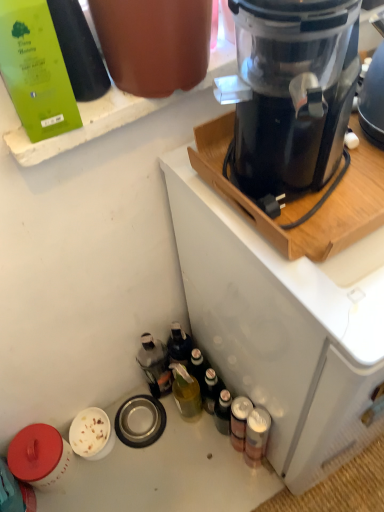
What do you see at coordinates (292, 87) in the screenshot?
I see `black plastic blender at upper right` at bounding box center [292, 87].

Identify the location of black plastic coffee maker at upper right. (283, 327).

What do you see at coordinates (79, 50) in the screenshot? Image resolution: width=384 pixels, height=512 pixels. I see `green matte bottle at upper left, which ranks as the 3th bottle in back-to-front order` at bounding box center [79, 50].

Locate an element on the screen. black plastic blender at upper right is located at coordinates (292, 87).

This screenshot has height=512, width=384. Identify the location of the 3rd bottle counting from the left side of the black plastic coffee maker at upper right. (79, 50).

Would you say green matte bottle at upper left, the first bottle from the front, is outside black plastic coffee maker at upper right?

Yes, green matte bottle at upper left, the first bottle from the front, is located beyond the bounds of black plastic coffee maker at upper right.

From a real-world perspective, who is located higher, green matte bottle at upper left, positioned as the 1th bottle in top-to-bottom order, or black plastic coffee maker at upper right?

In real-world perspective, green matte bottle at upper left, positioned as the 1th bottle in top-to-bottom order, is above.

Based on the photo, is green matte bottle at upper left, positioned as the 1th bottle in top-to-bottom order, facing away from black plastic coffee maker at upper right?

That's not correct — green matte bottle at upper left, positioned as the 1th bottle in top-to-bottom order, is not looking away from black plastic coffee maker at upper right.

Measure the distance from translucent plastic bottle at lower left, the 2th bottle from the top, to metallic silver can at lower right, the 2th bottle positioned from the front.

The distance of translucent plastic bottle at lower left, the 2th bottle from the top, from metallic silver can at lower right, the 2th bottle positioned from the front, is 11.79 inches.

Is translucent plastic bottle at lower left, placed as the 2th bottle when sorted from bottom to top, thinner than metallic silver can at lower right, the 2th bottle positioned from the front?

No.

Between translucent plastic bottle at lower left, the 3th bottle positioned from the front, and metallic silver can at lower right, the 3th bottle when ordered from top to bottom, which one appears on the left side from the viewer's perspective?

translucent plastic bottle at lower left, the 3th bottle positioned from the front, is more to the left.

Is black plastic coffee maker at upper right situated inside black plastic blender at upper right or outside?

black plastic coffee maker at upper right cannot be found inside black plastic blender at upper right.

From a real-world perspective, is black plastic coffee maker at upper right on top of black plastic blender at upper right?

Actually, black plastic coffee maker at upper right is physically below black plastic blender at upper right in the real world.

Is black plastic coffee maker at upper right to the left of black plastic blender at upper right from the viewer's perspective?

No.

Is black plastic coffee maker at upper right facing away from black plastic blender at upper right?

No, black plastic coffee maker at upper right's orientation is not away from black plastic blender at upper right.

Looking at this image, from the image's perspective, is metallic silver can at lower right, the 1th bottle in the bottom-to-top sequence, under translucent plastic bottle at lower left, the 2th bottle from the top?

Yes, from the image's perspective, metallic silver can at lower right, the 1th bottle in the bottom-to-top sequence, is below translucent plastic bottle at lower left, the 2th bottle from the top.

Is metallic silver can at lower right, positioned as the 1th bottle in right-to-left order, looking in the opposite direction of translucent plastic bottle at lower left, placed as the 2th bottle when sorted from bottom to top?

No, metallic silver can at lower right, positioned as the 1th bottle in right-to-left order, is not facing away from translucent plastic bottle at lower left, placed as the 2th bottle when sorted from bottom to top.

Where is `bottle that is on the right side of translucent plastic bottle at lower left, the 2th bottle from the top`? This screenshot has height=512, width=384. bottle that is on the right side of translucent plastic bottle at lower left, the 2th bottle from the top is located at coordinates (239, 421).

Based on their positions, is metallic silver can at lower right, the 1th bottle in the bottom-to-top sequence, located to the left or right of translucent plastic bottle at lower left, the first bottle from the back?

In the image, metallic silver can at lower right, the 1th bottle in the bottom-to-top sequence, appears on the right side of translucent plastic bottle at lower left, the first bottle from the back.

From a real-world perspective, is translucent plastic bottle at lower left, placed as the 2th bottle when sorted from bottom to top, positioned above or below green matte bottle at upper left, the third bottle from the right?

In terms of real-world spatial position, translucent plastic bottle at lower left, placed as the 2th bottle when sorted from bottom to top, is below green matte bottle at upper left, the third bottle from the right.

Looking at this image, considering the relative positions of translucent plastic bottle at lower left, the second bottle viewed from the left, and green matte bottle at upper left, which ranks as the 3th bottle in back-to-front order, in the image provided, is translucent plastic bottle at lower left, the second bottle viewed from the left, to the left or to the right of green matte bottle at upper left, which ranks as the 3th bottle in back-to-front order,?

translucent plastic bottle at lower left, the second bottle viewed from the left, is positioned on green matte bottle at upper left, which ranks as the 3th bottle in back-to-front order,'s right side.

Is green matte bottle at upper left, the first bottle from the front, at the back of translucent plastic bottle at lower left, the first bottle from the back?

translucent plastic bottle at lower left, the first bottle from the back, is not turned away from green matte bottle at upper left, the first bottle from the front.

Which of these two, black plastic blender at upper right or black plastic coffee maker at upper right, is thinner?

black plastic blender at upper right is thinner.

Which object is positioned more to the left, black plastic blender at upper right or black plastic coffee maker at upper right?

From the viewer's perspective, black plastic blender at upper right appears more on the left side.

Does point (315, 162) appear closer or farther from the camera than point (245, 281)?

Point (315, 162).

In terms of height, does metallic silver can at lower right, the 2th bottle in the back-to-front sequence, look taller or shorter compared to black plastic blender at upper right?

metallic silver can at lower right, the 2th bottle in the back-to-front sequence, is shorter than black plastic blender at upper right.

Could you tell me if metallic silver can at lower right, arranged as the third bottle when viewed from the left, is facing black plastic blender at upper right?

No.

From the image's perspective, does metallic silver can at lower right, the 2th bottle positioned from the front, appear lower than black plastic blender at upper right?

Correct, metallic silver can at lower right, the 2th bottle positioned from the front, appears lower than black plastic blender at upper right in the image.

Is metallic silver can at lower right, the 2th bottle positioned from the front, placed right next to black plastic blender at upper right?

No.

Where is `home appliance below the green matte bottle at upper left, the 3th bottle ordered from the bottom (from the image's perspective)`? home appliance below the green matte bottle at upper left, the 3th bottle ordered from the bottom (from the image's perspective) is located at coordinates (283, 327).

Where is `bottle located underneath the translucent plastic bottle at lower left, arranged as the 2th bottle when viewed from the right (from a real-world perspective)`? bottle located underneath the translucent plastic bottle at lower left, arranged as the 2th bottle when viewed from the right (from a real-world perspective) is located at coordinates (239, 421).

When comparing their distances from metallic silver can at lower right, positioned as the 1th bottle in right-to-left order, does black plastic blender at upper right or green matte bottle at upper left, the 3th bottle ordered from the bottom, seem closer?

Based on the image, black plastic blender at upper right appears to be nearer to metallic silver can at lower right, positioned as the 1th bottle in right-to-left order.

When comparing their distances from black plastic coffee maker at upper right, does green matte bottle at upper left, the 3th bottle ordered from the bottom, or translucent plastic bottle at lower left, arranged as the 2th bottle when viewed from the right, seem closer?

The object closer to black plastic coffee maker at upper right is translucent plastic bottle at lower left, arranged as the 2th bottle when viewed from the right.

Looking at the image, which one is located closer to green matte bottle at upper left, positioned as the 1th bottle in top-to-bottom order, black plastic blender at upper right or black plastic coffee maker at upper right?

black plastic blender at upper right is positioned closer to the anchor green matte bottle at upper left, positioned as the 1th bottle in top-to-bottom order.

From the image, which object appears to be farther from black plastic coffee maker at upper right, black plastic blender at upper right or metallic silver can at lower right, the 1th bottle in the bottom-to-top sequence?

The object further to black plastic coffee maker at upper right is metallic silver can at lower right, the 1th bottle in the bottom-to-top sequence.

Which object lies further to the anchor point translucent plastic bottle at lower left, the 3th bottle positioned from the front, green matte bottle at upper left, the 3th bottle ordered from the bottom, or black plastic blender at upper right?

green matte bottle at upper left, the 3th bottle ordered from the bottom.

Considering their positions, is metallic silver can at lower right, positioned as the 1th bottle in right-to-left order, positioned closer to black plastic coffee maker at upper right than translucent plastic bottle at lower left, placed as the 2th bottle when sorted from bottom to top?

metallic silver can at lower right, positioned as the 1th bottle in right-to-left order, is closer to black plastic coffee maker at upper right.

From the image, which object appears to be nearer to green matte bottle at upper left, which ranks as the first bottle in left-to-right order, metallic silver can at lower right, the 2th bottle positioned from the front, or black plastic coffee maker at upper right?

black plastic coffee maker at upper right is closer to green matte bottle at upper left, which ranks as the first bottle in left-to-right order.

Estimate the real-world distances between objects in this image. Which object is further from translucent plastic bottle at lower left, the 2th bottle from the top, metallic silver can at lower right, the 2th bottle positioned from the front, or green matte bottle at upper left, which ranks as the first bottle in left-to-right order?

The object further to translucent plastic bottle at lower left, the 2th bottle from the top, is green matte bottle at upper left, which ranks as the first bottle in left-to-right order.

Find the location of `home appliance between black plastic blender at upper right and translucent plastic bottle at lower left, the 2th bottle from the top, from front to back`. home appliance between black plastic blender at upper right and translucent plastic bottle at lower left, the 2th bottle from the top, from front to back is located at coordinates (283, 327).

Identify the location of blender situated between green matte bottle at upper left, which ranks as the 3th bottle in back-to-front order, and black plastic coffee maker at upper right from left to right. The image size is (384, 512). (292, 87).

Where is `home appliance between green matte bottle at upper left, the first bottle from the front, and metallic silver can at lower right, the 2th bottle positioned from the front, in the vertical direction`? The width and height of the screenshot is (384, 512). home appliance between green matte bottle at upper left, the first bottle from the front, and metallic silver can at lower right, the 2th bottle positioned from the front, in the vertical direction is located at coordinates (283, 327).

Where is `home appliance between green matte bottle at upper left, positioned as the 1th bottle in top-to-bottom order, and translucent plastic bottle at lower left, arranged as the 2th bottle when viewed from the right, from front to back`? This screenshot has height=512, width=384. home appliance between green matte bottle at upper left, positioned as the 1th bottle in top-to-bottom order, and translucent plastic bottle at lower left, arranged as the 2th bottle when viewed from the right, from front to back is located at coordinates (283, 327).